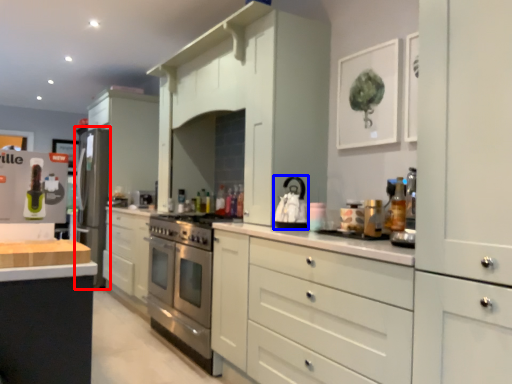
Question: Which object is further to the camera taking this photo, appliance (highlighted by a red box) or appliance (highlighted by a blue box)?

Choices:
 (A) appliance
 (B) appliance

Answer: (A)